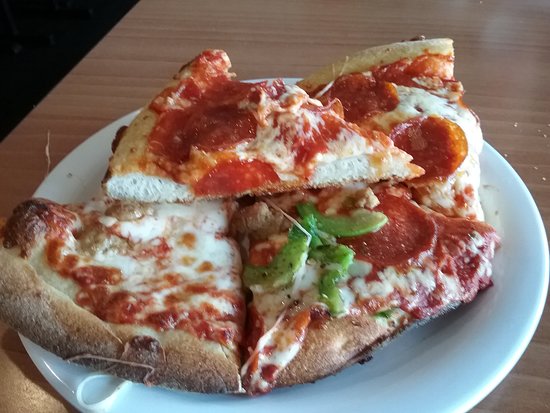
Locate an element on the screen. flat plate is located at coordinates (421, 368).